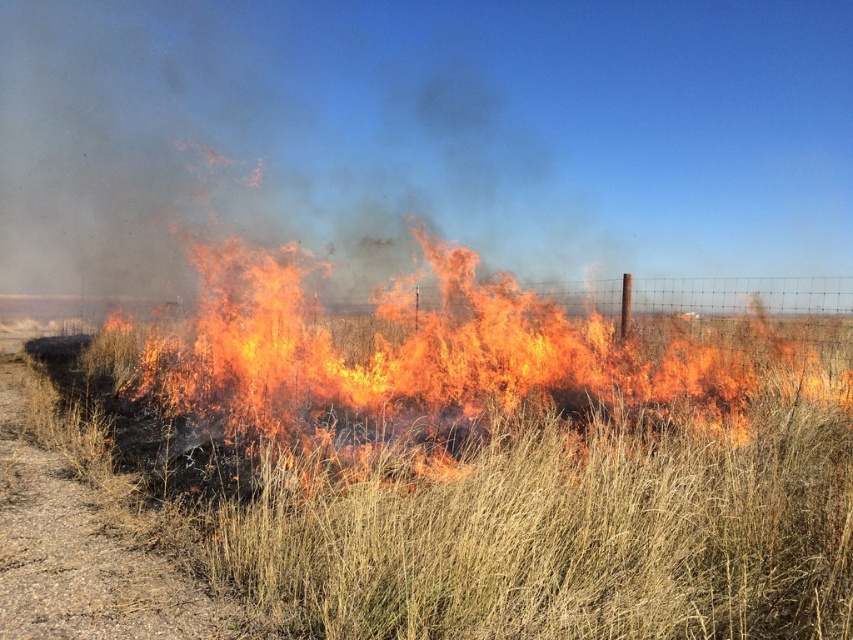
You are a firefighter assessing the fire scene. You notice the grassy field at center and the brown gravel road at lower left. Which area is higher in elevation?

The grassy field at center has a greater height compared to brown gravel road at lower left, so the grassy field at center is higher in elevation.

You are a firefighter observing the scene. The fire is spreading towards the wire fence. Where is the grassy field at center in relation to the fence?

The grassy field at center is located at point (492, 509), which is near the middle ground where the fence runs horizontally. Since the fence is in the middle ground and the field is at the center, the grassy field is positioned behind the fence, meaning the fire is moving towards the fence from the field side.